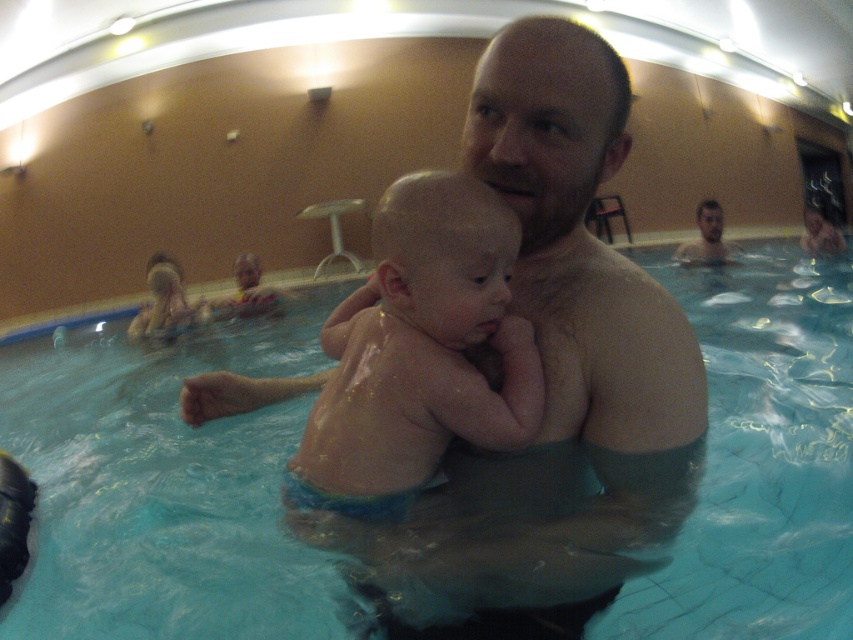
Question: Is smooth skin man at center thinner than smooth skin baby at center?

Choices:
 (A) yes
 (B) no

Answer: (B)

Question: Can you confirm if blue smooth water at center is smaller than smooth skin man at upper right?

Choices:
 (A) yes
 (B) no

Answer: (B)

Question: Which of the following is the closest to the observer?

Choices:
 (A) (720, 259)
 (B) (705, 609)

Answer: (B)

Question: Which object is farther from the camera taking this photo?

Choices:
 (A) blue smooth water at center
 (B) smooth skin man at center
 (C) smooth skin baby at center
 (D) smooth skin man at upper right

Answer: (D)

Question: Which object is positioned closest to the smooth skin man at upper right?

Choices:
 (A) blue smooth water at center
 (B) smooth skin man at center
 (C) smooth skin baby at center

Answer: (A)

Question: Can you confirm if blue smooth water at center is positioned to the left of smooth skin man at center?

Choices:
 (A) yes
 (B) no

Answer: (A)